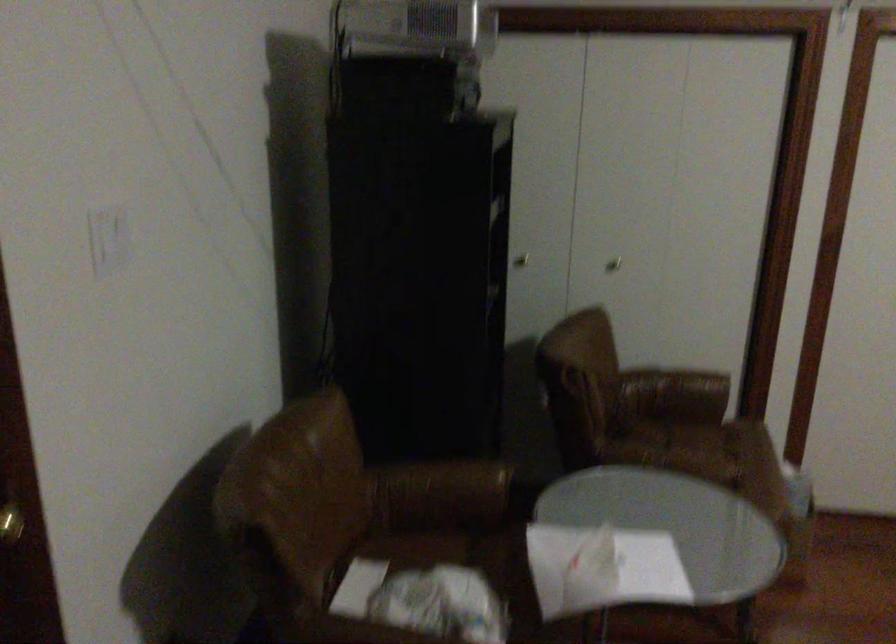
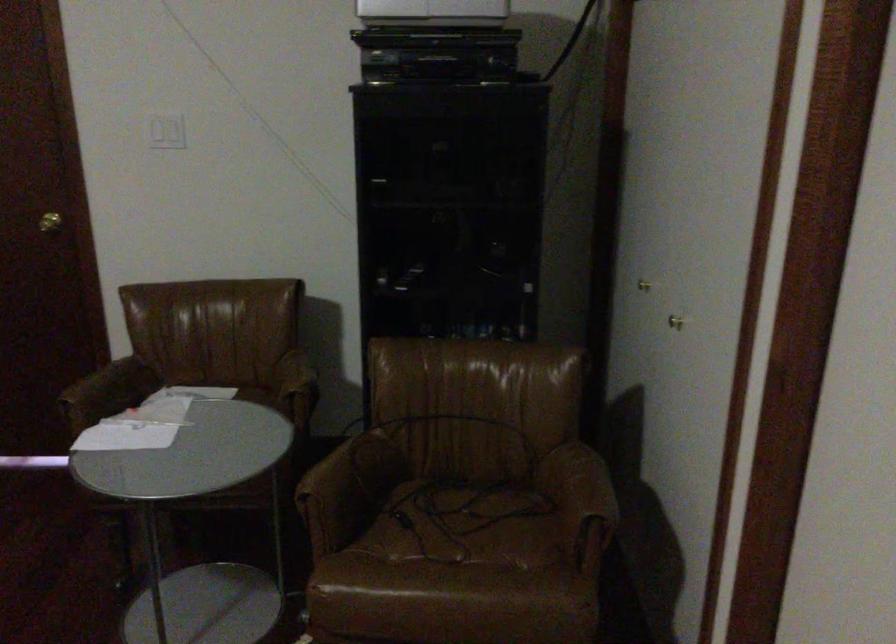
Find the pixel in the second image that matches point (673, 451) in the first image.

(464, 525)